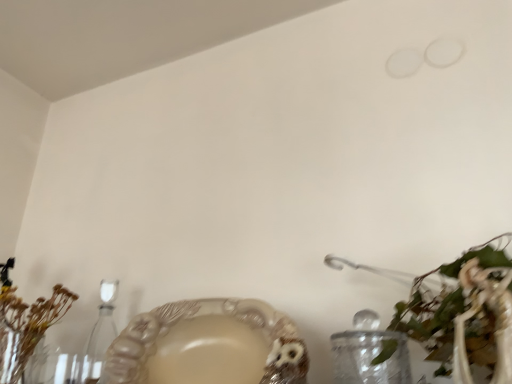
How much space does brown dried flowers at left, the 2th floral arrangement when ordered from right to left, occupy horizontally?

7.23 inches.

This screenshot has width=512, height=384. What do you see at coordinates (100, 334) in the screenshot?
I see `clear glass candle holder at lower left` at bounding box center [100, 334].

What do you see at coordinates (208, 345) in the screenshot? I see `matte beige bowl at lower center` at bounding box center [208, 345].

The width and height of the screenshot is (512, 384). I want to click on green leafy plant at lower right, the first floral arrangement positioned from the right, so click(459, 308).

From the image's perspective, does matte beige bowl at lower center appear lower than clear glass candle holder at lower left?

Incorrect, from the image's perspective, matte beige bowl at lower center is higher than clear glass candle holder at lower left.

Would you say matte beige bowl at lower center is a long distance from clear glass candle holder at lower left?

That's not correct — matte beige bowl at lower center is a little close to clear glass candle holder at lower left.

Do you think matte beige bowl at lower center is within clear glass candle holder at lower left, or outside of it?

matte beige bowl at lower center is outside clear glass candle holder at lower left.

You are a GUI agent. You are given a task and a screenshot of the screen. Output one action in this format:
    pyautogui.click(x=<x>, y=<y>)
    Task: Click on the tableware above the brown dried flowers at left, marked as the second floral arrangement in a front-to-back arrangement (from the image's perspective)
    
    Given the screenshot: What is the action you would take?
    pyautogui.click(x=208, y=345)

Is brown dried flowers at left, the 2th floral arrangement when ordered from right to left, not near matte beige bowl at lower center?

brown dried flowers at left, the 2th floral arrangement when ordered from right to left, is actually quite close to matte beige bowl at lower center.

Can you tell me how much brown dried flowers at left, marked as the second floral arrangement in a front-to-back arrangement, and matte beige bowl at lower center differ in facing direction?

There is a 3.13-degree angle between the facing directions of brown dried flowers at left, marked as the second floral arrangement in a front-to-back arrangement, and matte beige bowl at lower center.

Does brown dried flowers at left, which is the first floral arrangement in left-to-right order, have a lesser width compared to matte beige bowl at lower center?

In fact, brown dried flowers at left, which is the first floral arrangement in left-to-right order, might be wider than matte beige bowl at lower center.

Is clear glass candle holder at lower left completely or partially outside of matte beige bowl at lower center?

Yes, clear glass candle holder at lower left is outside of matte beige bowl at lower center.

Which object is closer to the camera taking this photo, clear glass candle holder at lower left or matte beige bowl at lower center?

matte beige bowl at lower center is more forward.

Is point (94, 327) closer or farther from the camera than point (161, 354)?

Point (94, 327).

How different are the orientations of green leafy plant at lower right, the first floral arrangement positioned from the right, and brown dried flowers at left, which is the first floral arrangement in left-to-right order, in degrees?

1.94 degrees separate the facing orientations of green leafy plant at lower right, the first floral arrangement positioned from the right, and brown dried flowers at left, which is the first floral arrangement in left-to-right order.

Is the surface of green leafy plant at lower right, acting as the second floral arrangement starting from the left, in direct contact with brown dried flowers at left, the 2th floral arrangement when ordered from right to left?

No, green leafy plant at lower right, acting as the second floral arrangement starting from the left, is not with brown dried flowers at left, the 2th floral arrangement when ordered from right to left.

Is point (442, 310) closer or farther from the camera than point (62, 288)?

Point (442, 310) appears to be closer to the viewer than point (62, 288).

Considering the relative positions of green leafy plant at lower right, the 1th floral arrangement in the front-to-back sequence, and brown dried flowers at left, which is counted as the 1th floral arrangement, starting from the back, in the image provided, is green leafy plant at lower right, the 1th floral arrangement in the front-to-back sequence, behind brown dried flowers at left, which is counted as the 1th floral arrangement, starting from the back,?

No, green leafy plant at lower right, the 1th floral arrangement in the front-to-back sequence, is in front of brown dried flowers at left, which is counted as the 1th floral arrangement, starting from the back.

Is brown dried flowers at left, which is counted as the 1th floral arrangement, starting from the back, positioned beyond the bounds of green leafy plant at lower right, the 1th floral arrangement in the front-to-back sequence?

Absolutely, brown dried flowers at left, which is counted as the 1th floral arrangement, starting from the back, is external to green leafy plant at lower right, the 1th floral arrangement in the front-to-back sequence.

Is brown dried flowers at left, which is counted as the 1th floral arrangement, starting from the back, in front of or behind green leafy plant at lower right, arranged as the 2th floral arrangement when viewed from the back, in the image?

brown dried flowers at left, which is counted as the 1th floral arrangement, starting from the back, is positioned farther from the viewer than green leafy plant at lower right, arranged as the 2th floral arrangement when viewed from the back.

Does brown dried flowers at left, which is the first floral arrangement in left-to-right order, touch green leafy plant at lower right, acting as the second floral arrangement starting from the left?

No, brown dried flowers at left, which is the first floral arrangement in left-to-right order, is not next to green leafy plant at lower right, acting as the second floral arrangement starting from the left.

From a real-world perspective, is brown dried flowers at left, which is counted as the 1th floral arrangement, starting from the back, physically above green leafy plant at lower right, the 1th floral arrangement in the front-to-back sequence?

Correct, in the physical world, brown dried flowers at left, which is counted as the 1th floral arrangement, starting from the back, is higher than green leafy plant at lower right, the 1th floral arrangement in the front-to-back sequence.

Is brown dried flowers at left, which is the first floral arrangement in left-to-right order, not within clear glass candle holder at lower left?

Yes, brown dried flowers at left, which is the first floral arrangement in left-to-right order, is located beyond the bounds of clear glass candle holder at lower left.

In the scene shown: How many degrees apart are the facing directions of brown dried flowers at left, which is the first floral arrangement in left-to-right order, and clear glass candle holder at lower left?

0.571 degrees separate the facing orientations of brown dried flowers at left, which is the first floral arrangement in left-to-right order, and clear glass candle holder at lower left.

Is brown dried flowers at left, the 2th floral arrangement when ordered from right to left, positioned before clear glass candle holder at lower left?

Yes, brown dried flowers at left, the 2th floral arrangement when ordered from right to left, is in front of clear glass candle holder at lower left.

Is brown dried flowers at left, the 2th floral arrangement when ordered from right to left, bigger or smaller than clear glass candle holder at lower left?

Clearly, brown dried flowers at left, the 2th floral arrangement when ordered from right to left, is larger in size than clear glass candle holder at lower left.

From a real-world perspective, is green leafy plant at lower right, acting as the second floral arrangement starting from the left, positioned over matte beige bowl at lower center based on gravity?

No, from a real-world perspective, green leafy plant at lower right, acting as the second floral arrangement starting from the left, is not over matte beige bowl at lower center

From the image's perspective, which one is positioned higher, green leafy plant at lower right, the first floral arrangement positioned from the right, or matte beige bowl at lower center?

From the image's view, green leafy plant at lower right, the first floral arrangement positioned from the right, is above.

Is matte beige bowl at lower center located within green leafy plant at lower right, acting as the second floral arrangement starting from the left?

No.

Image resolution: width=512 pixels, height=384 pixels. I want to click on candle holder above the matte beige bowl at lower center (from a real-world perspective), so click(x=100, y=334).

Where is `tableware beneath the brown dried flowers at left, which is the first floral arrangement in left-to-right order (from a real-world perspective)`? tableware beneath the brown dried flowers at left, which is the first floral arrangement in left-to-right order (from a real-world perspective) is located at coordinates (208, 345).

Which object lies nearer to the anchor point matte beige bowl at lower center, green leafy plant at lower right, the first floral arrangement positioned from the right, or brown dried flowers at left, which is counted as the 1th floral arrangement, starting from the back?

The object closer to matte beige bowl at lower center is green leafy plant at lower right, the first floral arrangement positioned from the right.

Based on their spatial positions, is green leafy plant at lower right, arranged as the 2th floral arrangement when viewed from the back, or brown dried flowers at left, marked as the second floral arrangement in a front-to-back arrangement, closer to clear glass candle holder at lower left?

brown dried flowers at left, marked as the second floral arrangement in a front-to-back arrangement, lies closer to clear glass candle holder at lower left than the other object.

Looking at the image, which one is located closer to matte beige bowl at lower center, clear glass candle holder at lower left or green leafy plant at lower right, the first floral arrangement positioned from the right?

The object closer to matte beige bowl at lower center is clear glass candle holder at lower left.

Considering their positions, is matte beige bowl at lower center positioned closer to brown dried flowers at left, marked as the second floral arrangement in a front-to-back arrangement, than green leafy plant at lower right, the 1th floral arrangement in the front-to-back sequence?

matte beige bowl at lower center lies closer to brown dried flowers at left, marked as the second floral arrangement in a front-to-back arrangement, than the other object.

Looking at the image, which one is located closer to brown dried flowers at left, the 2th floral arrangement when ordered from right to left, matte beige bowl at lower center or clear glass candle holder at lower left?

Among the two, clear glass candle holder at lower left is located nearer to brown dried flowers at left, the 2th floral arrangement when ordered from right to left.

From the image, which object appears to be farther from brown dried flowers at left, marked as the second floral arrangement in a front-to-back arrangement, clear glass candle holder at lower left or matte beige bowl at lower center?

Among the two, matte beige bowl at lower center is located further to brown dried flowers at left, marked as the second floral arrangement in a front-to-back arrangement.

Based on their spatial positions, is green leafy plant at lower right, acting as the second floral arrangement starting from the left, or matte beige bowl at lower center closer to clear glass candle holder at lower left?

matte beige bowl at lower center lies closer to clear glass candle holder at lower left than the other object.

Looking at the image, which one is located further to green leafy plant at lower right, the 1th floral arrangement in the front-to-back sequence, brown dried flowers at left, marked as the second floral arrangement in a front-to-back arrangement, or clear glass candle holder at lower left?

Among the two, brown dried flowers at left, marked as the second floral arrangement in a front-to-back arrangement, is located further to green leafy plant at lower right, the 1th floral arrangement in the front-to-back sequence.

Find the location of a particular element. The width and height of the screenshot is (512, 384). candle holder situated between brown dried flowers at left, which is counted as the 1th floral arrangement, starting from the back, and green leafy plant at lower right, acting as the second floral arrangement starting from the left, from left to right is located at coordinates (100, 334).

Locate an element on the screen. tableware between brown dried flowers at left, which is the first floral arrangement in left-to-right order, and green leafy plant at lower right, acting as the second floral arrangement starting from the left is located at coordinates (208, 345).

Where is `tableware between clear glass candle holder at lower left and green leafy plant at lower right, the 1th floral arrangement in the front-to-back sequence, from left to right`? tableware between clear glass candle holder at lower left and green leafy plant at lower right, the 1th floral arrangement in the front-to-back sequence, from left to right is located at coordinates (208, 345).

You are a GUI agent. You are given a task and a screenshot of the screen. Output one action in this format:
    pyautogui.click(x=<x>, y=<y>)
    Task: Click on the candle holder between brown dried flowers at left, which is counted as the 1th floral arrangement, starting from the back, and matte beige bowl at lower center from left to right
    This screenshot has width=512, height=384.
    Given the screenshot: What is the action you would take?
    pyautogui.click(x=100, y=334)